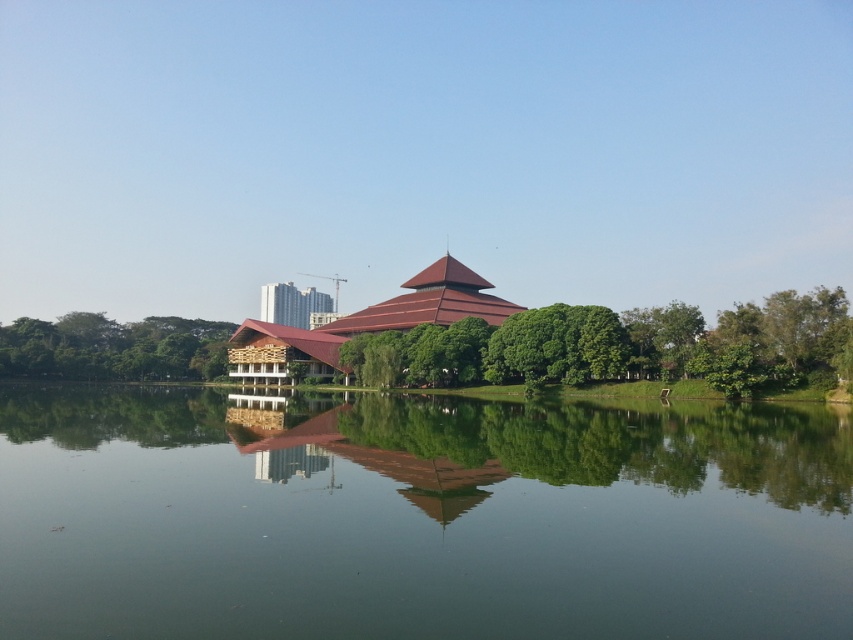
You are standing on the lakeside dock and want to take a photo of both the green leafy tree at left and the metallic glass building at center. Which object should you frame first if you want to include both in your shot without cropping either?

You should frame the green leafy tree at left first because it might be wider than the metallic glass building at center, so ensuring it fits properly would help in capturing both without cropping.

You are standing at the lakeside and want to determine which of the two points, point (730, 552) or point (308, 310), is nearer to you. Based on the scene, which point is closer?

Point (730, 552) is closer to the viewer than point (308, 310).

You are standing at the center of the lakeside and want to take a photo of the traditional building with the green leafy tree at left in the background. Based on their positions, will the tree be partially or fully visible in the photo?

The green leafy tree at left is located at point (113,348), which means it will be partially visible in the photo as it is positioned to the left side of the frame.